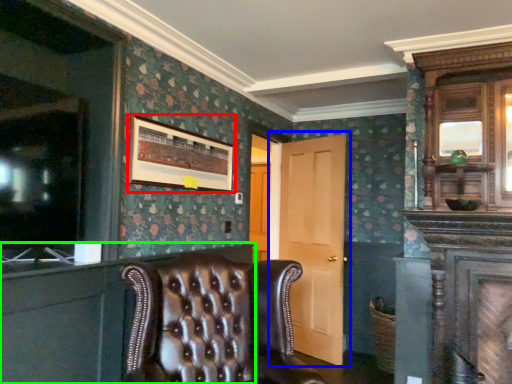
Question: Based on their relative distances, which object is nearer to picture frame (highlighted by a red box)? Choose from door (highlighted by a blue box) and dresser (highlighted by a green box).

Choices:
 (A) door
 (B) dresser

Answer: (B)